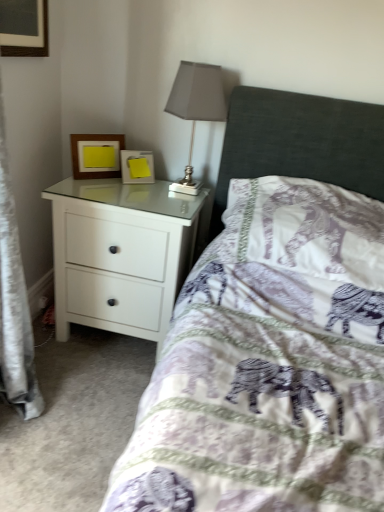
Locate an element on the screen. The image size is (384, 512). vacant area that lies between yellow paper at upper left, which is counted as the first picture frame, starting from the right, and matte gray lampshade at upper center is located at coordinates (144, 188).